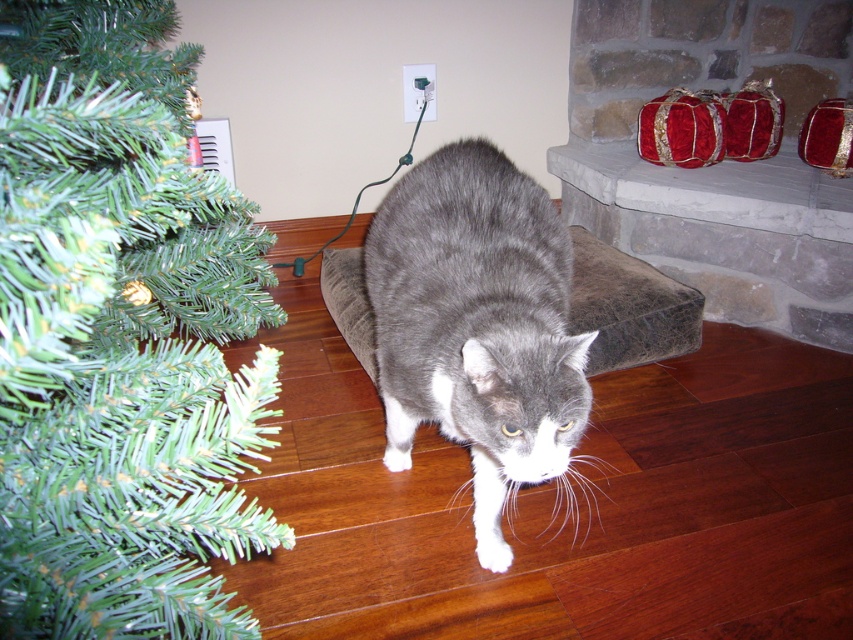
Between green artificial at left and gray fur cat at center, which one is positioned lower?

green artificial at left is below.

Where is `green artificial at left`? The height and width of the screenshot is (640, 853). green artificial at left is located at coordinates (120, 337).

Image resolution: width=853 pixels, height=640 pixels. In order to click on green artificial at left in this screenshot , I will do `click(120, 337)`.